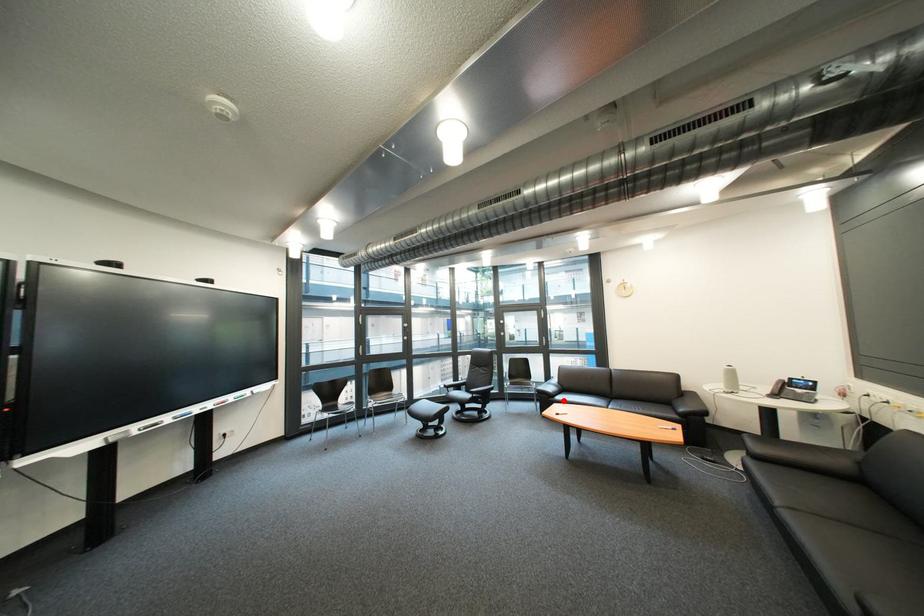
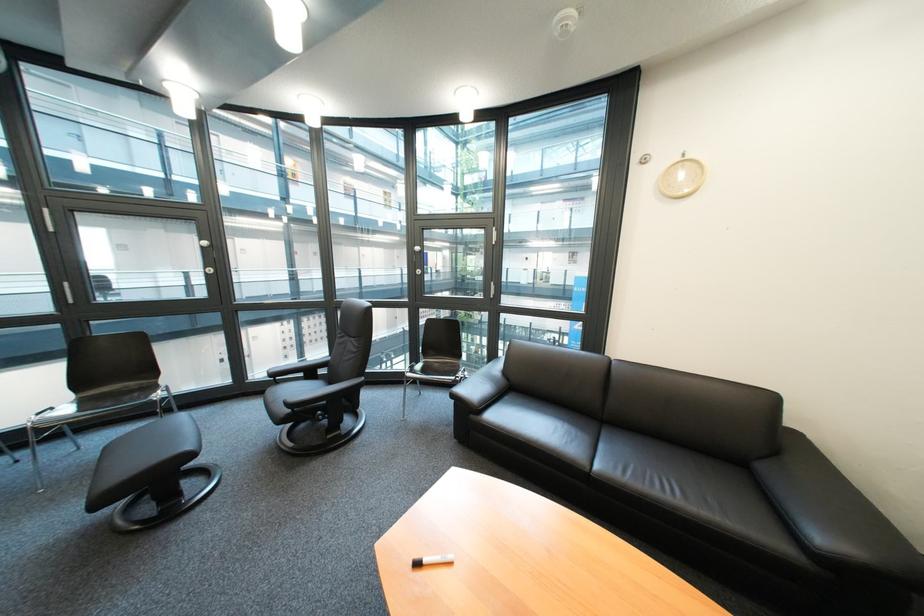
Question: I am providing you with two images of the same scene from different viewpoints. Given a red point in image1, look at the same physical point in image2. Is it:

Choices:
 (A) Closer to the viewpoint
 (B) Farther from the viewpoint

Answer: (B)